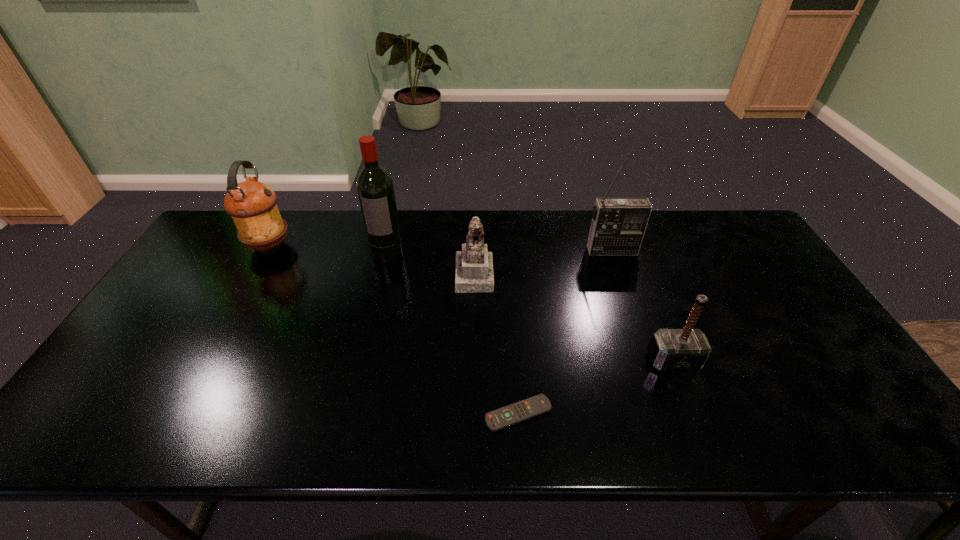
Identify the location of vacant region between the oil lamp and the radio receiver. The height and width of the screenshot is (540, 960). (441, 248).

You are a GUI agent. You are given a task and a screenshot of the screen. Output one action in this format:
    pyautogui.click(x=<x>, y=<y>)
    Task: Click on the free point between the radio receiver and the shortest object
    This screenshot has width=960, height=540.
    Given the screenshot: What is the action you would take?
    pyautogui.click(x=565, y=332)

What are the coordinates of `vacant point located between the fifth object from right to left and the oil lamp` in the screenshot? It's located at (328, 249).

Image resolution: width=960 pixels, height=540 pixels. What are the coordinates of `vacant area between the leftmost object and the figurine` in the screenshot? It's located at (372, 260).

Where is `free point between the remote control and the radio receiver`? The image size is (960, 540). free point between the remote control and the radio receiver is located at coordinates (565, 332).

This screenshot has width=960, height=540. What are the coordinates of `free point between the hammer and the fourth shortest object` in the screenshot? It's located at (471, 303).

Identify the location of free spot between the wine bottle and the figurine. The width and height of the screenshot is (960, 540). (430, 264).

Where is `the third closest object relative to the figurine`? the third closest object relative to the figurine is located at coordinates (501, 418).

The height and width of the screenshot is (540, 960). I want to click on object identified as the closest to the wine bottle, so click(x=473, y=264).

Locate an element on the screen. The width and height of the screenshot is (960, 540). blank space that satisfies the following two spatial constraints: 1. on the back side of the nearest object; 2. on the front-facing side of the figurine is located at coordinates (509, 274).